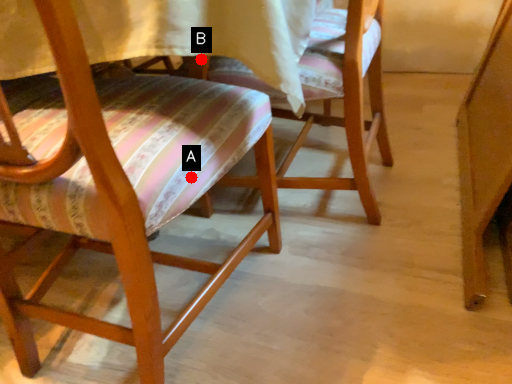
Question: Two points are circled on the image, labeled by A and B beside each circle. Which point appears farthest from the camera in this image?

Choices:
 (A) A is further
 (B) B is further

Answer: (B)